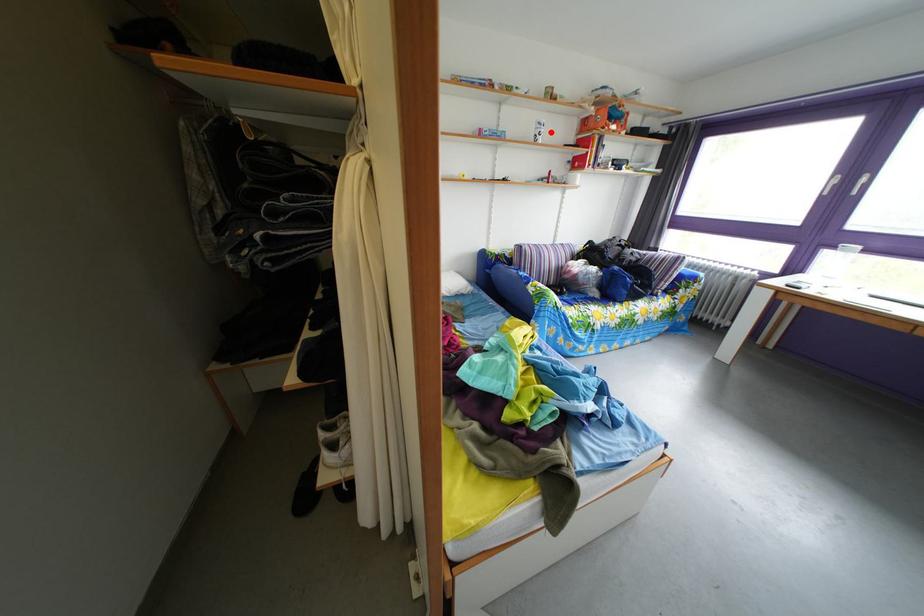
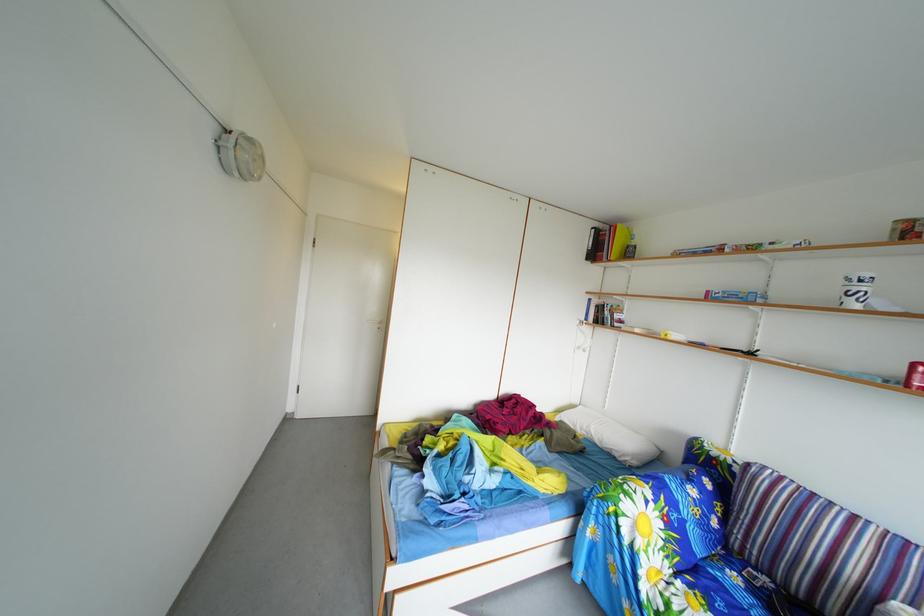
Where in the second image is the point corresponding to the highlighted location from the first image?

(859, 288)